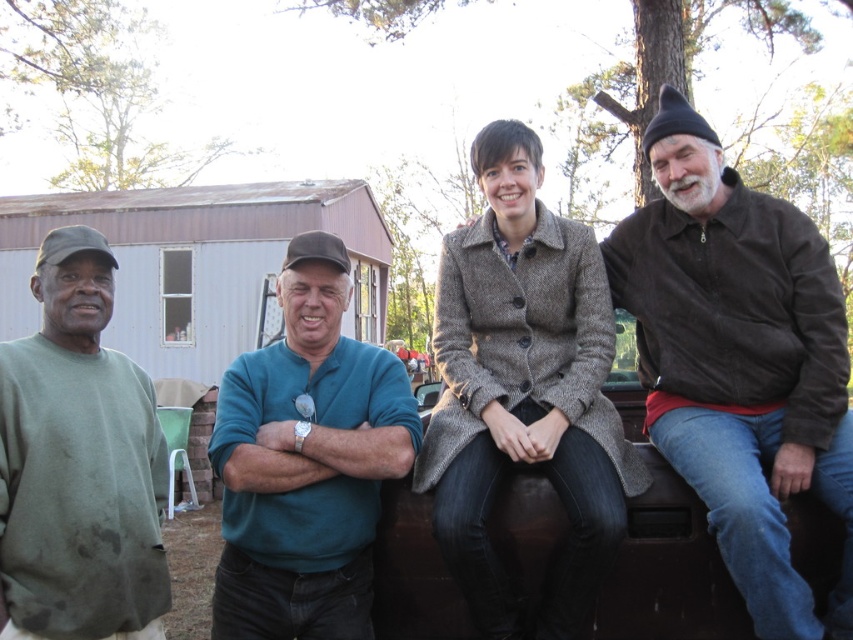
Question: From the image, what is the correct spatial relationship of brown woolen coat at center in relation to teal fabric shirt at center?

Choices:
 (A) above
 (B) below

Answer: (A)

Question: Does brown corduroy jacket at right have a greater width compared to green matte sweatshirt at left?

Choices:
 (A) yes
 (B) no

Answer: (A)

Question: Which point appears farthest from the camera in this image?

Choices:
 (A) (659, 138)
 (B) (283, 484)
 (C) (445, 412)
 (D) (93, 273)

Answer: (A)

Question: Does brown corduroy jacket at right appear over green matte sweatshirt at left?

Choices:
 (A) no
 (B) yes

Answer: (B)

Question: Which point is farther to the camera?

Choices:
 (A) (505, 212)
 (B) (77, 557)
 (C) (323, 620)
 (D) (798, 394)

Answer: (A)

Question: Which point is farther from the camera taking this photo?

Choices:
 (A) (315, 312)
 (B) (593, 442)

Answer: (A)